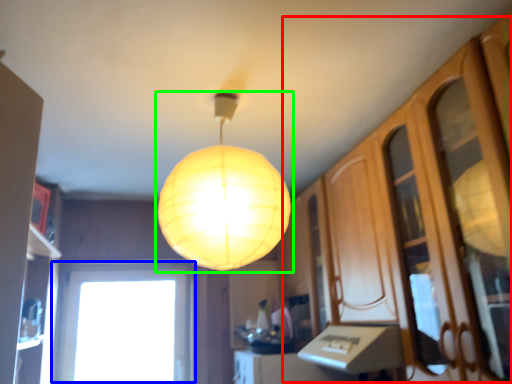
Question: Which object is the closest to the dresser (highlighted by a red box)? Choose among these: window (highlighted by a blue box) or lamp (highlighted by a green box).

Choices:
 (A) window
 (B) lamp

Answer: (B)